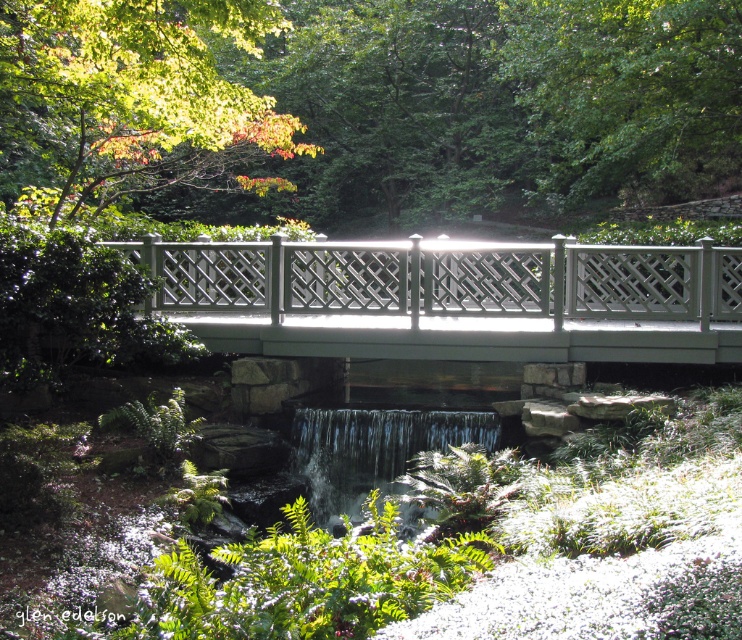
Question: Is white lattice bridge at center below clear glass waterfall at center?

Choices:
 (A) yes
 (B) no

Answer: (B)

Question: Is white lattice bridge at center wider than clear glass waterfall at center?

Choices:
 (A) no
 (B) yes

Answer: (A)

Question: Which of the following is the closest to the observer?

Choices:
 (A) (312, 412)
 (B) (640, 260)

Answer: (B)

Question: Is white lattice bridge at center to the left of clear glass waterfall at center from the viewer's perspective?

Choices:
 (A) yes
 (B) no

Answer: (A)